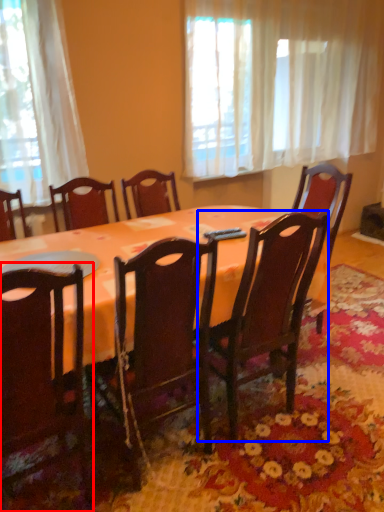
Question: Which object appears farthest to the camera in this image, chair (highlighted by a red box) or chair (highlighted by a blue box)?

Choices:
 (A) chair
 (B) chair

Answer: (B)